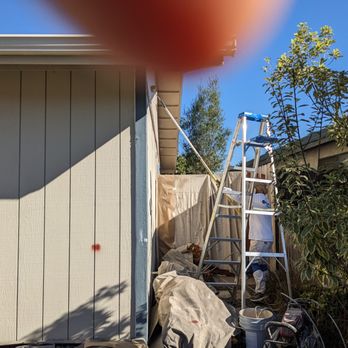
What are the coordinates of `shadow on door` in the screenshot? It's located at (68, 125).